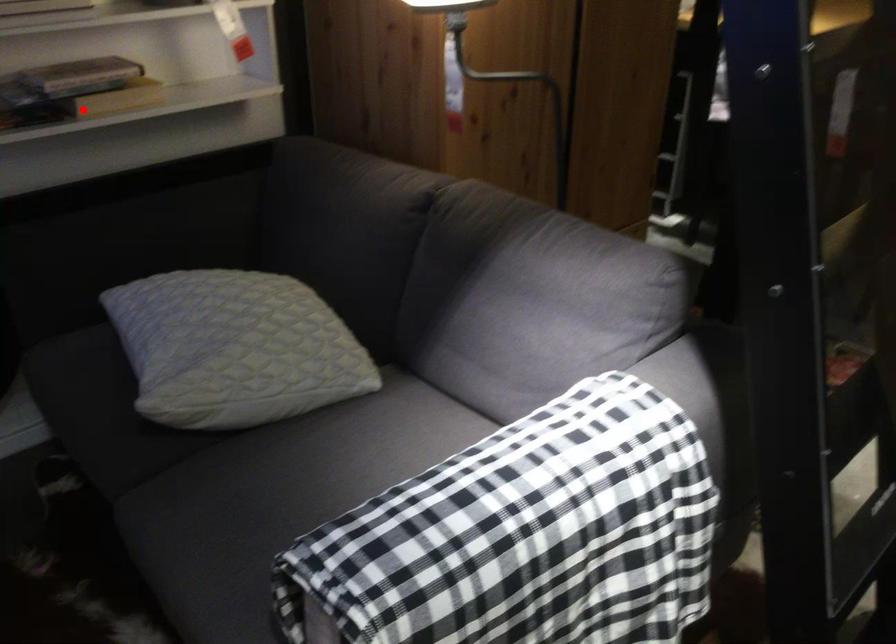
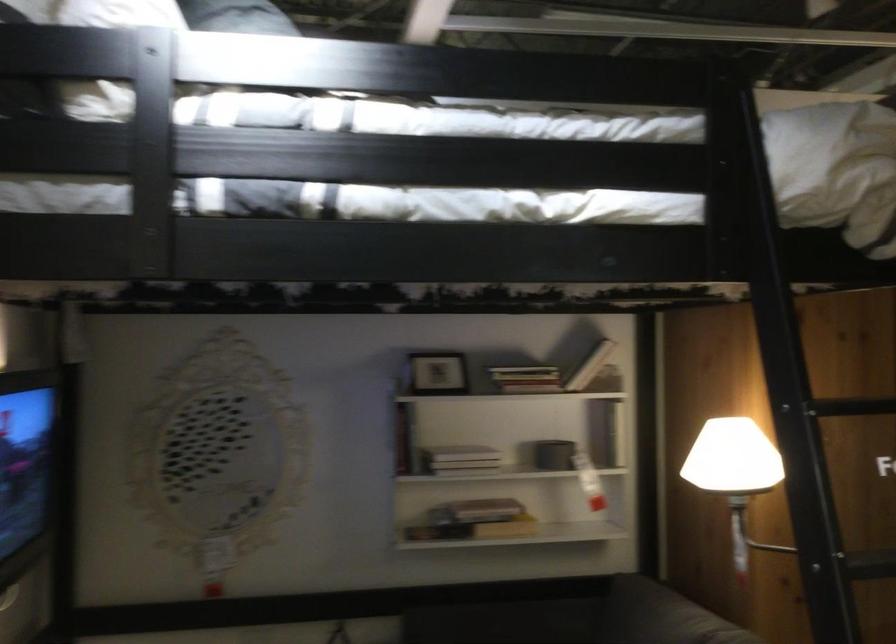
Locate, in the second image, the point that corresponds to the highlighted location in the first image.

(474, 529)